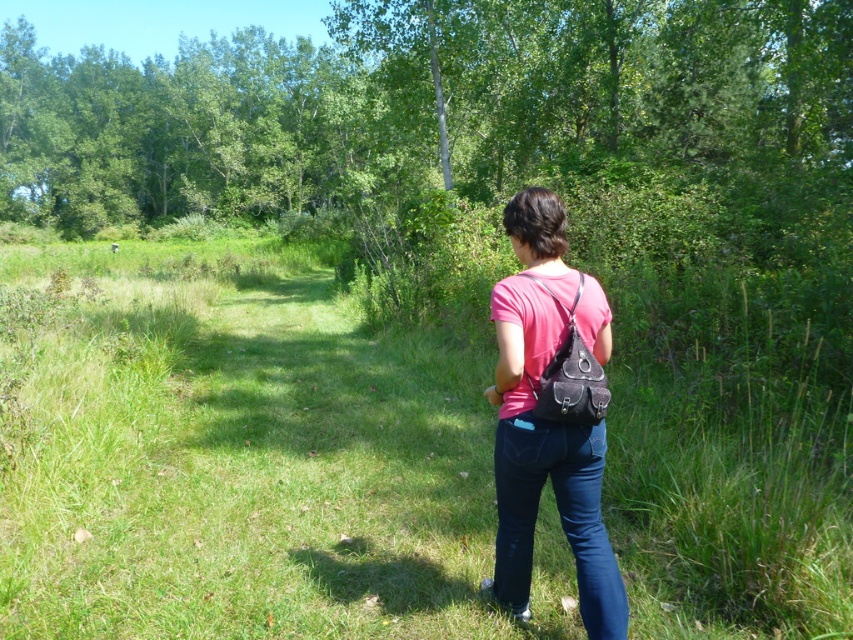
You are standing on the path and see the green grassy at center and the pink fabric shirt at center. Which object is closer to you?

The pink fabric shirt at center is closer to you because it is positioned in front of the green grassy at center, which is further away.